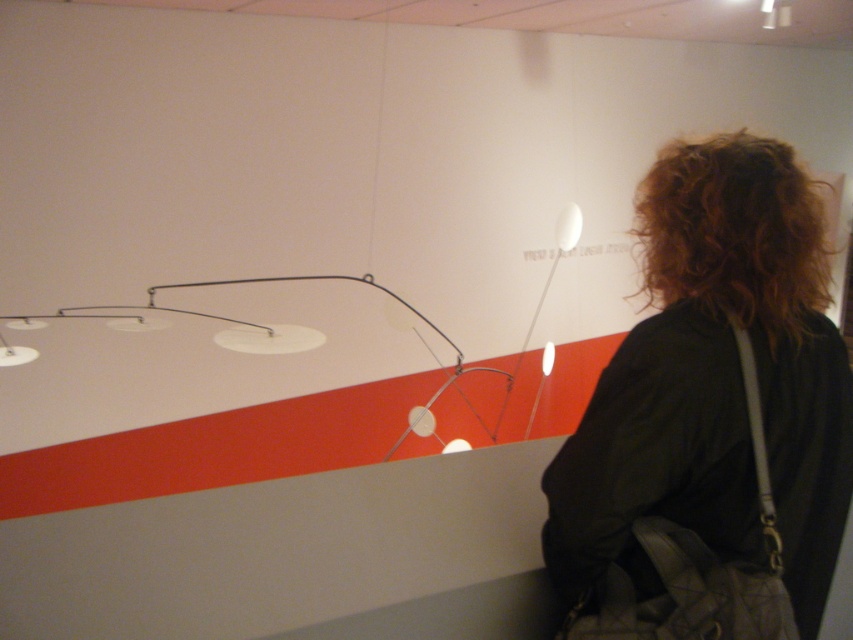
Question: Which point appears closest to the camera in this image?

Choices:
 (A) (830, 472)
 (B) (772, 353)

Answer: (B)

Question: Where is dark brown hair at upper right located in relation to curly brown hair at upper right in the image?

Choices:
 (A) left
 (B) right

Answer: (A)

Question: Which point is closer to the camera taking this photo?

Choices:
 (A) (677, 273)
 (B) (741, 467)

Answer: (B)

Question: In this image, where is dark brown hair at upper right located relative to curly brown hair at upper right?

Choices:
 (A) left
 (B) right

Answer: (A)

Question: Can you confirm if dark brown hair at upper right is positioned to the left of curly brown hair at upper right?

Choices:
 (A) no
 (B) yes

Answer: (B)